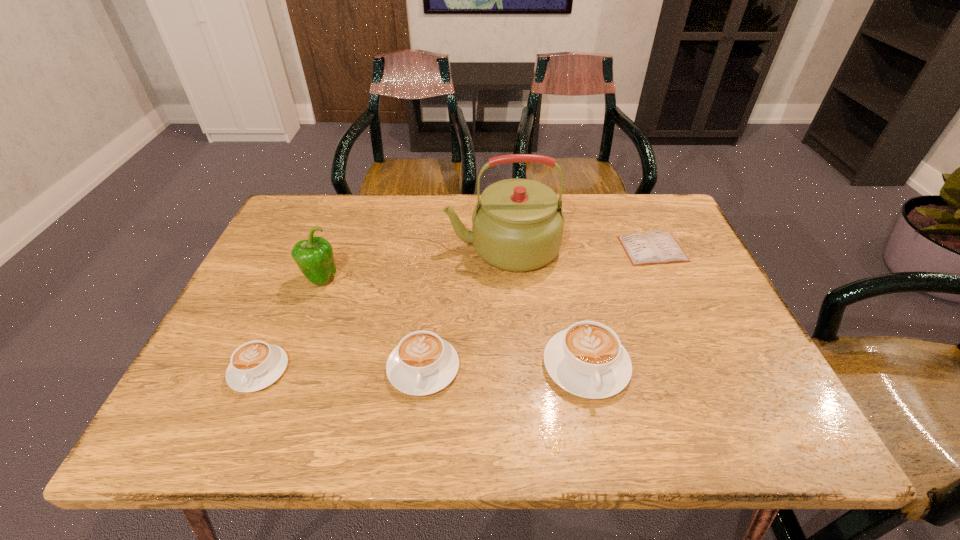
Identify the location of object present at the near left corner. (255, 365).

Find the location of `object present at the far right corner`. object present at the far right corner is located at coordinates (x=656, y=247).

Where is `vacant space at the far edge`? This screenshot has height=540, width=960. vacant space at the far edge is located at coordinates (469, 225).

Find the location of a particular element. free space at the near edge of the desktop is located at coordinates (557, 395).

Where is `vacant space at the left edge of the desktop`? This screenshot has width=960, height=540. vacant space at the left edge of the desktop is located at coordinates (252, 318).

You are a GUI agent. You are given a task and a screenshot of the screen. Output one action in this format:
    pyautogui.click(x=<x>, y=<y>)
    Task: Click on the vacant region at the right edge of the desktop
    Image resolution: width=960 pixels, height=540 pixels.
    Given the screenshot: What is the action you would take?
    pyautogui.click(x=658, y=281)

Identify the location of vacant space at the far left corner. (336, 199).

Image resolution: width=960 pixels, height=540 pixels. Identify the location of vacant space at the near left corner of the desktop. coord(209,388).

The width and height of the screenshot is (960, 540). Find the location of `unoccupied area between the kettle and the leftmost cappuccino`. unoccupied area between the kettle and the leftmost cappuccino is located at coordinates (381, 309).

You are a GUI agent. You are given a task and a screenshot of the screen. Output one action in this format:
    pyautogui.click(x=<x>, y=<y>)
    Task: Click on the empty space that is in between the tallest object and the shortest object
    
    Given the screenshot: What is the action you would take?
    pyautogui.click(x=578, y=248)